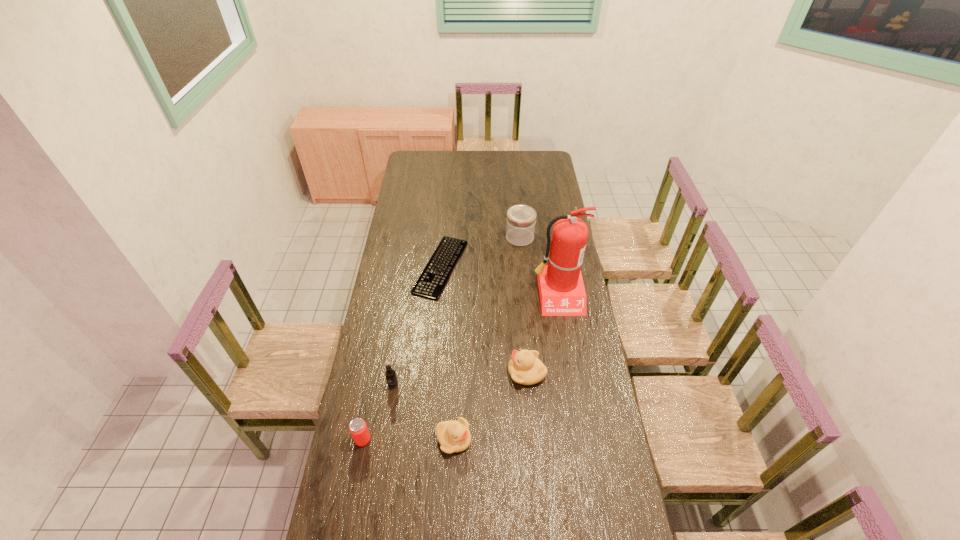
Identify the location of the shorter duckling. Image resolution: width=960 pixels, height=540 pixels. (454, 436).

Where is `the nearer duckling`? The image size is (960, 540). the nearer duckling is located at coordinates (454, 436).

At what (x,y) coordinates should I click in order to perform the action: click on the taller duckling. Please return your answer as a coordinate pair (x, y). This screenshot has width=960, height=540. Looking at the image, I should click on (525, 368).

Locate an element on the screen. This screenshot has height=540, width=960. the farther duckling is located at coordinates (525, 368).

Find the location of a particular element. jar is located at coordinates (521, 219).

This screenshot has width=960, height=540. I want to click on root beer, so click(390, 374).

Where is `computer keyboard`? The width and height of the screenshot is (960, 540). computer keyboard is located at coordinates (432, 281).

At what (x,y) coordinates should I click in order to perform the action: click on the tallest object. Please return your answer as a coordinate pair (x, y). The height and width of the screenshot is (540, 960). Looking at the image, I should click on (562, 293).

The height and width of the screenshot is (540, 960). In order to click on the leftmost object in this screenshot , I will do `click(358, 428)`.

Locate an element on the screen. free space located on the beak of the nearer duckling is located at coordinates (512, 440).